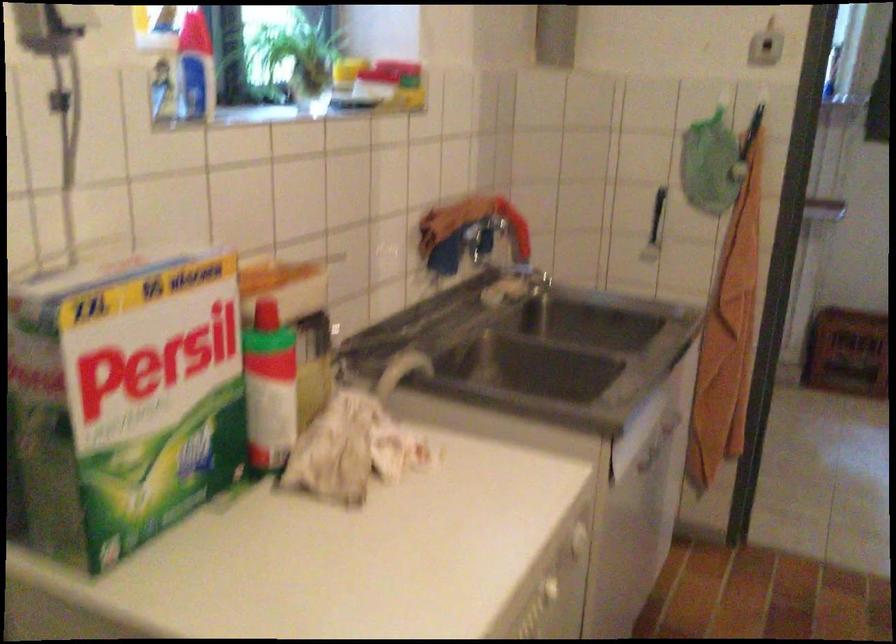
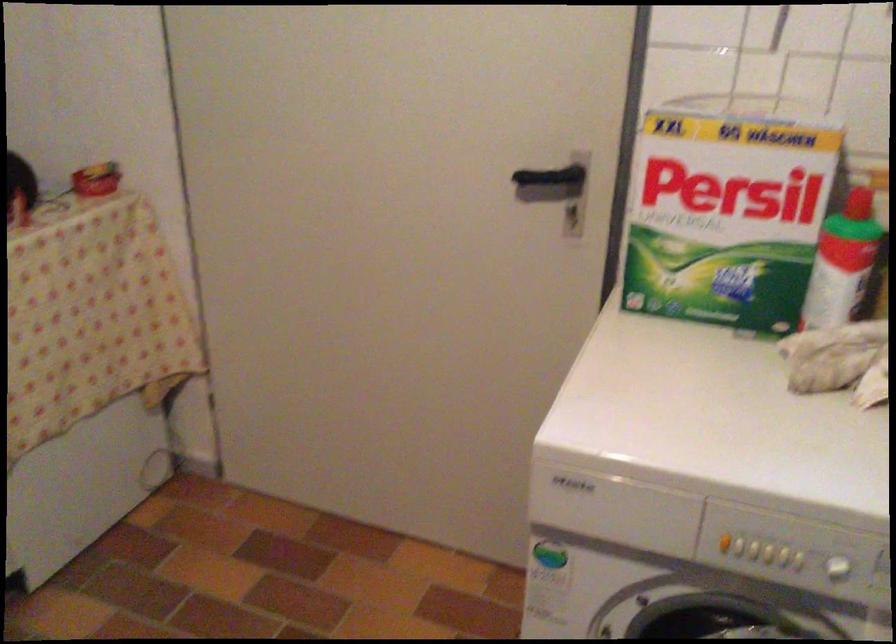
Find the pixel in the second image that matches point (283, 383) in the first image.

(842, 263)